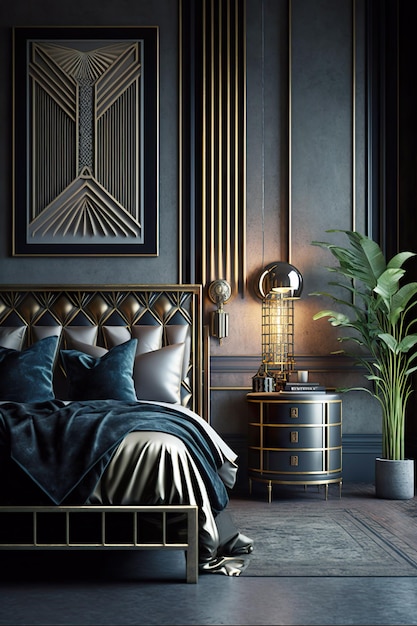
The width and height of the screenshot is (417, 626). Identify the location of baseboard. (365, 454), (241, 448), (240, 479), (295, 486), (258, 481), (311, 486), (334, 483), (409, 444).